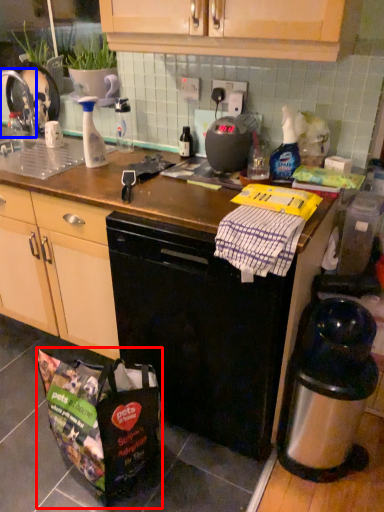
Question: Which object appears closest to the camera in this image, bag (highlighted by a red box) or faucet (highlighted by a blue box)?

Choices:
 (A) bag
 (B) faucet

Answer: (A)